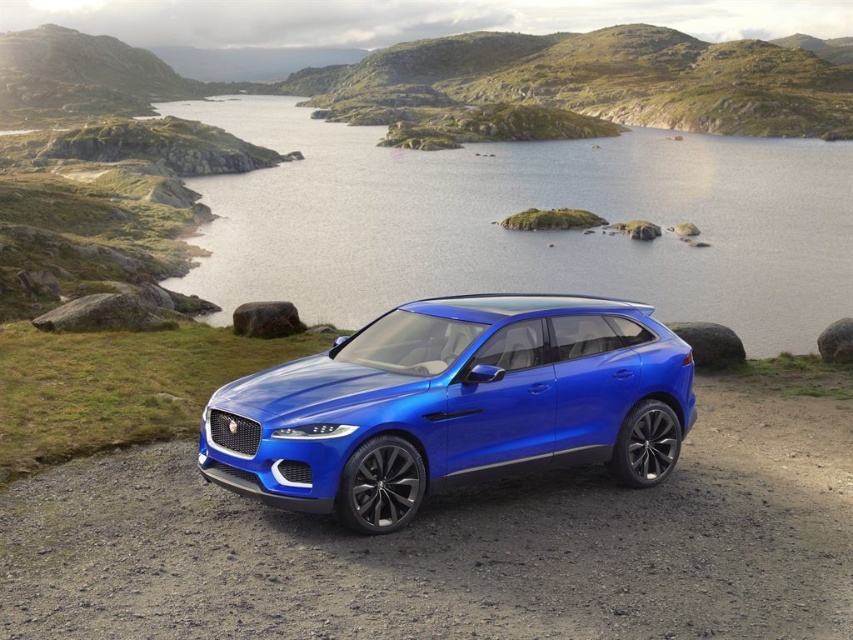
You are a photographer planning to capture the entire scene of the glossy blue water at center and the shiny metallic blue suv at center in a single shot. Based on their sizes, which object would require you to adjust your camera angle more to ensure both are fully visible?

The glossy blue water at center is bigger than the shiny metallic blue suv at center, so the glossy blue water at center would require more adjustment to ensure both are fully visible in the frame.

In the scene shown: You are a photographer standing at the edge of the gravel surface where the shiny metallic blue suv at center is parked. You want to take a photo of the glossy blue water at center. Which object is closer to you, the photographer, so you can focus on it first?

The glossy blue water at center is further to the viewer than the shiny metallic blue suv at center, so the suv is closer to you. Therefore, you should focus on the shiny metallic blue suv at center first before adjusting your focus to the glossy blue water at center.

You are a delivery drone with a maximum flight range of 100 feet. You need to deliver a package from the shiny metallic blue suv at center to the glossy blue water at center. Can you complete the delivery without needing to recharge?

The distance between the shiny metallic blue suv at center and the glossy blue water at center is 85.34 feet, which is within your 100 feet flight range. Yes, you can complete the delivery without needing to recharge.